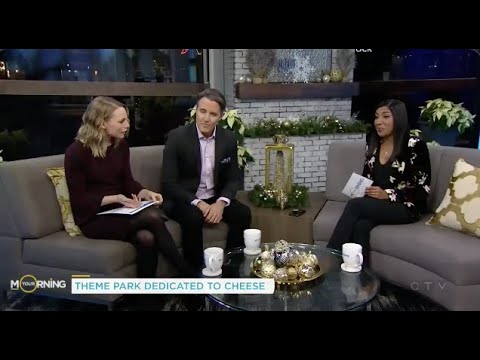
I want to click on couch, so click(427, 239).